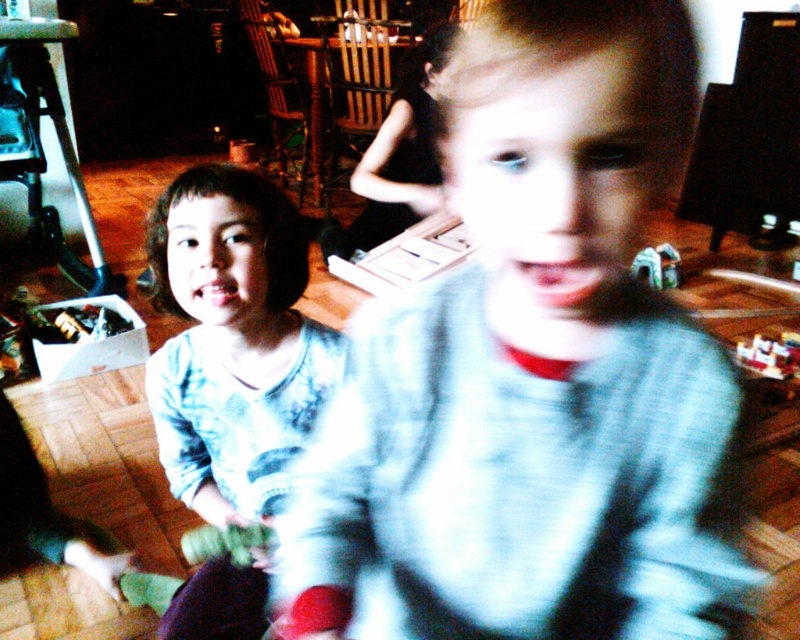
Is point (192, 474) more distant than point (638, 262)?

No.

Does light blue cotton shirt at center come in front of plastic toy car at center?

Yes.

Between point (274, 362) and point (644, 253), which one is positioned in front?

Positioned in front is point (274, 362).

The height and width of the screenshot is (640, 800). I want to click on light blue cotton shirt at center, so click(232, 340).

Is light blue sweater at center positioned before light blue cotton shirt at center?

Yes, light blue sweater at center is closer to the viewer.

Is light blue sweater at center to the left of light blue cotton shirt at center from the viewer's perspective?

Incorrect, light blue sweater at center is not on the left side of light blue cotton shirt at center.

The width and height of the screenshot is (800, 640). What do you see at coordinates (532, 374) in the screenshot?
I see `light blue sweater at center` at bounding box center [532, 374].

This screenshot has height=640, width=800. Identify the location of light blue sweater at center. (532, 374).

Who is positioned more to the left, light blue cotton shirt at center or plastic toy car at lower right?

light blue cotton shirt at center is more to the left.

Who is higher up, light blue cotton shirt at center or plastic toy car at lower right?

plastic toy car at lower right is above.

What are the coordinates of `light blue cotton shirt at center` in the screenshot? It's located at (232, 340).